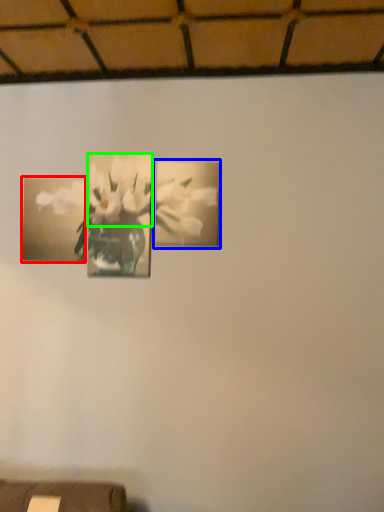
Question: Which is nearer to the picture frame (highlighted by a red box)? picture frame (highlighted by a blue box) or flower (highlighted by a green box).

Choices:
 (A) picture frame
 (B) flower

Answer: (B)